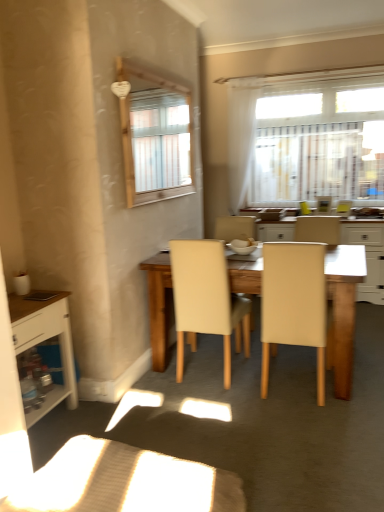
Question: Is white sheer curtain at upper center completely or partially inside white wood cabinet at left?

Choices:
 (A) yes
 (B) no

Answer: (B)

Question: Is white wood cabinet at left wider than white sheer curtain at upper center?

Choices:
 (A) no
 (B) yes

Answer: (B)

Question: Is white wood cabinet at left next to white sheer curtain at upper center and touching it?

Choices:
 (A) yes
 (B) no

Answer: (B)

Question: Is white wood cabinet at left aimed at white sheer curtain at upper center?

Choices:
 (A) yes
 (B) no

Answer: (B)

Question: From a real-world perspective, does white wood cabinet at left sit lower than white sheer curtain at upper center?

Choices:
 (A) yes
 (B) no

Answer: (A)

Question: Do you think wooden table at center is within white sheer curtain at upper center, or outside of it?

Choices:
 (A) outside
 (B) inside

Answer: (A)

Question: In the image, is wooden table at center on the left side or the right side of white sheer curtain at upper center?

Choices:
 (A) right
 (B) left

Answer: (B)

Question: Relative to white sheer curtain at upper center, is wooden table at center in front or behind?

Choices:
 (A) behind
 (B) front

Answer: (B)

Question: Is wooden table at center bigger or smaller than white sheer curtain at upper center?

Choices:
 (A) big
 (B) small

Answer: (A)

Question: Is wooden table at center wider or thinner than white glossy bowl at center?

Choices:
 (A) wide
 (B) thin

Answer: (A)

Question: Is wooden table at center spatially inside white glossy bowl at center, or outside of it?

Choices:
 (A) outside
 (B) inside

Answer: (A)

Question: From the image's perspective, is wooden table at center above or below white glossy bowl at center?

Choices:
 (A) below
 (B) above

Answer: (A)

Question: Would you say wooden table at center is to the left or to the right of white glossy bowl at center in the picture?

Choices:
 (A) left
 (B) right

Answer: (B)

Question: Is white wood cabinet at left inside the boundaries of white sheer curtain at upper center, or outside?

Choices:
 (A) outside
 (B) inside

Answer: (A)

Question: In terms of size, does white wood cabinet at left appear bigger or smaller than white sheer curtain at upper center?

Choices:
 (A) big
 (B) small

Answer: (A)